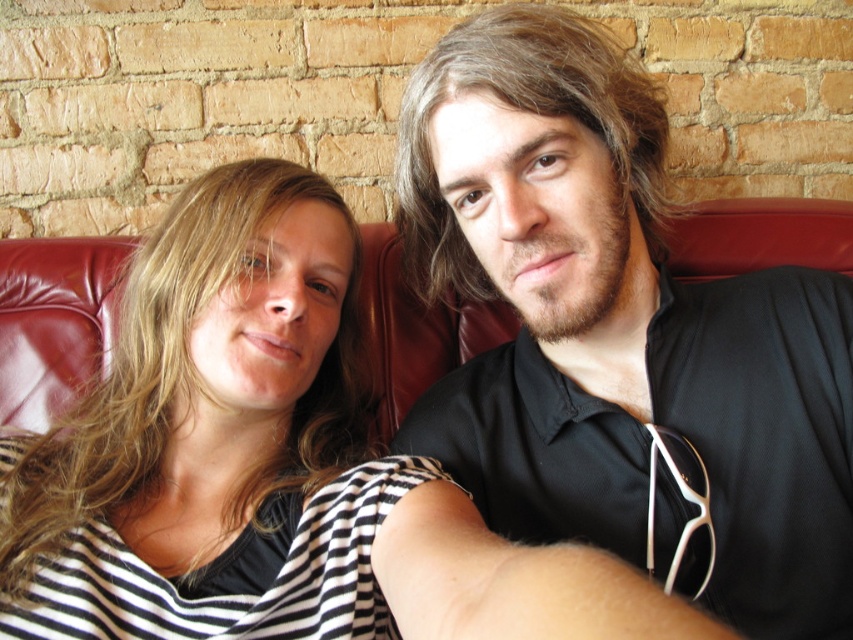
Question: Is black matte shirt at center smaller than striped fabric at center?

Choices:
 (A) yes
 (B) no

Answer: (A)

Question: Which point appears farthest from the camera in this image?

Choices:
 (A) (537, 109)
 (B) (146, 637)

Answer: (B)

Question: Is black matte shirt at center to the right of striped fabric at center from the viewer's perspective?

Choices:
 (A) no
 (B) yes

Answer: (B)

Question: Among these objects, which one is farthest from the camera?

Choices:
 (A) striped fabric at center
 (B) black matte shirt at center

Answer: (B)

Question: Does black matte shirt at center have a smaller size compared to striped fabric at center?

Choices:
 (A) yes
 (B) no

Answer: (A)